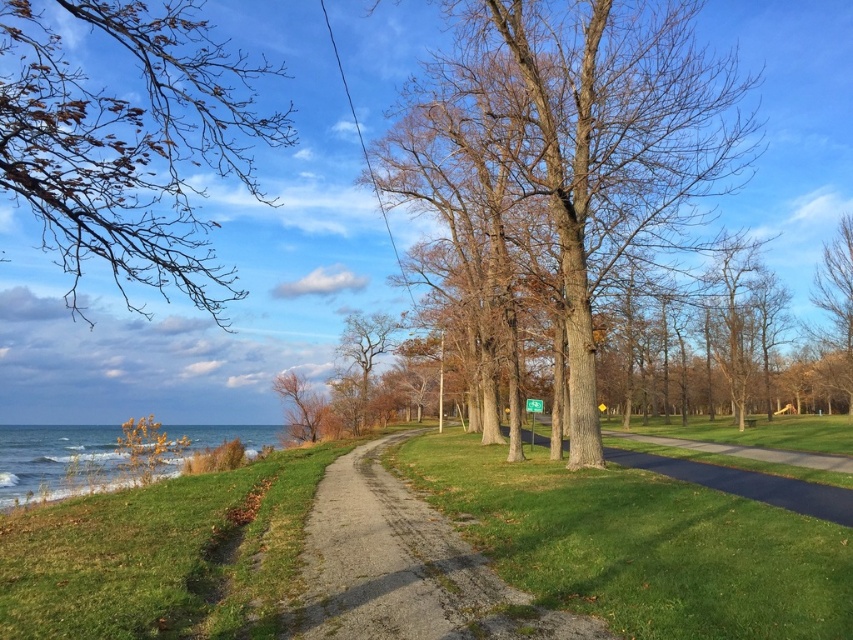
Question: Estimate the real-world distances between objects in this image. Which object is farther from the dark gray asphalt path at center?

Choices:
 (A) blue water at lower left
 (B) brown rough bark tree at center
 (C) brown textured tree at upper right
 (D) brown rough tree at center

Answer: (A)

Question: Does green grass at center have a lesser width compared to brown textured tree at upper right?

Choices:
 (A) no
 (B) yes

Answer: (A)

Question: Does blue water at lower left appear over brown rough tree at center-left?

Choices:
 (A) yes
 (B) no

Answer: (B)

Question: Where is dark gray asphalt path at center located in relation to brown rough tree at center-left in the image?

Choices:
 (A) right
 (B) left

Answer: (A)

Question: Among these objects, which one is farthest from the camera?

Choices:
 (A) brown rough tree at center-left
 (B) brown rough tree at center

Answer: (B)

Question: Among these points, which one is farthest from the camera?

Choices:
 (A) (659, 138)
 (B) (527, 412)
 (C) (0, 488)
 (D) (607, 460)

Answer: (B)